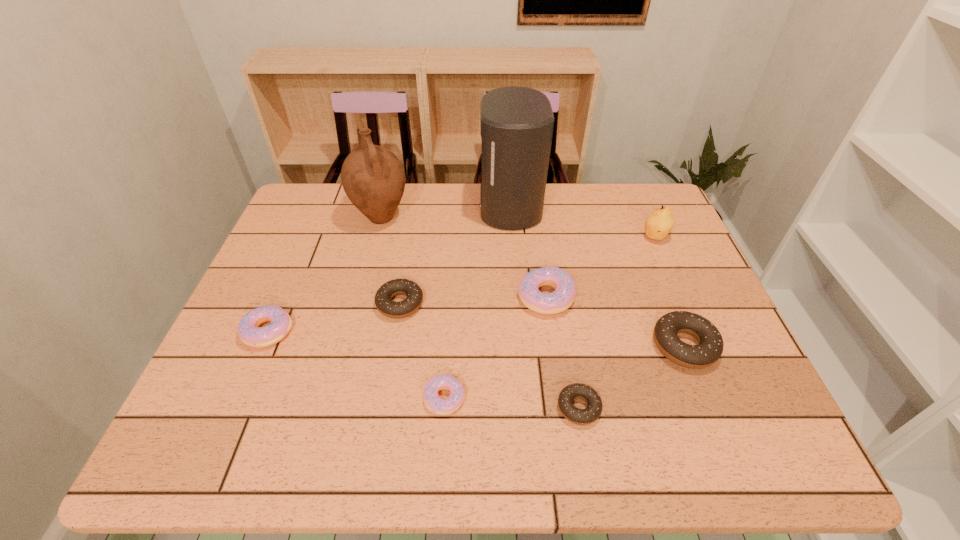
The width and height of the screenshot is (960, 540). In order to click on the second closest doughnut to the leftmost brown doughnut in this screenshot , I will do `click(250, 333)`.

Point out which doughnut is positioned as the second nearest to the nearest brown doughnut. Please provide its 2D coordinates. Your answer should be formatted as a tuple, i.e. [(x, y)], where the tuple contains the x and y coordinates of a point satisfying the conditions above.

[(437, 405)]

Locate an element on the screen. The height and width of the screenshot is (540, 960). pink doughnut that stands as the closest to the second biggest brown doughnut is located at coordinates (437, 405).

The width and height of the screenshot is (960, 540). Identify the location of pink doughnut that is the second closest to the second brown doughnut from right to left. (562, 298).

The image size is (960, 540). In order to click on brown doughnut that stands as the third closest to the pitcher in this screenshot , I will do `click(710, 345)`.

Identify the location of brown doughnut object that ranks as the third closest to the nearest pink doughnut. (710, 345).

Identify the location of vacant space that satisfies the following two spatial constraints: 1. on the front side of the second smallest pink doughnut; 2. on the left side of the nearest brown doughnut. Image resolution: width=960 pixels, height=540 pixels. [x=235, y=408].

You are a GUI agent. You are given a task and a screenshot of the screen. Output one action in this format:
    pyautogui.click(x=<x>, y=<y>)
    Task: Click on the free space that satisfies the following two spatial constraints: 1. on the button side of the smallest brown doughnut; 2. on the left side of the dark coffee maker
    The width and height of the screenshot is (960, 540).
    Given the screenshot: What is the action you would take?
    pyautogui.click(x=525, y=408)

The width and height of the screenshot is (960, 540). What are the coordinates of `vacant space that satisfies the following two spatial constraints: 1. on the front side of the eighth shortest object; 2. on the right side of the rightmost pink doughnut` in the screenshot? It's located at (361, 296).